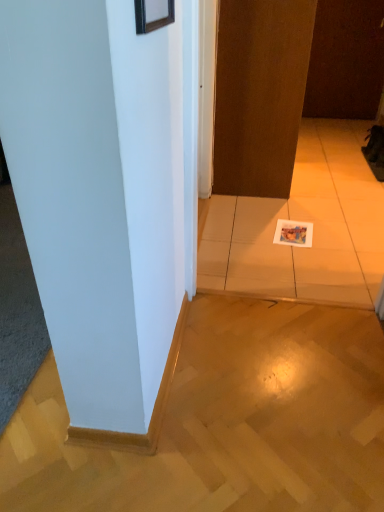
Question: Is the depth of white smooth pillar at center less than that of brown matte door at upper right, the 2th door in the bottom-to-top sequence?

Choices:
 (A) no
 (B) yes

Answer: (B)

Question: Considering the relative sizes of white smooth pillar at center and brown matte door at upper right, which is the 1th door from right to left, in the image provided, is white smooth pillar at center wider than brown matte door at upper right, which is the 1th door from right to left,?

Choices:
 (A) no
 (B) yes

Answer: (B)

Question: Can you confirm if white smooth pillar at center is bigger than brown matte door at upper right, which ranks as the second door in front-to-back order?

Choices:
 (A) no
 (B) yes

Answer: (B)

Question: Could you tell me if white smooth pillar at center is turned towards brown matte door at upper right, the 1th door viewed from the back?

Choices:
 (A) no
 (B) yes

Answer: (A)

Question: Can you confirm if white smooth pillar at center is positioned to the left of brown matte door at upper right, which is counted as the second door, starting from the left?

Choices:
 (A) no
 (B) yes

Answer: (B)

Question: In terms of height, does brown matte door at upper right, acting as the 1th door starting from the top, look taller or shorter compared to wooden picture frame at upper center?

Choices:
 (A) short
 (B) tall

Answer: (B)

Question: Considering the positions of point (317, 89) and point (153, 16), is point (317, 89) closer or farther from the camera than point (153, 16)?

Choices:
 (A) closer
 (B) farther

Answer: (B)

Question: Considering their positions, is brown matte door at upper right, acting as the 1th door starting from the top, located in front of or behind wooden picture frame at upper center?

Choices:
 (A) behind
 (B) front

Answer: (A)

Question: Is brown matte door at upper right, the 2th door in the bottom-to-top sequence, inside the boundaries of wooden picture frame at upper center, or outside?

Choices:
 (A) outside
 (B) inside

Answer: (A)

Question: Is wooden picture frame at upper center spatially inside white smooth pillar at center, or outside of it?

Choices:
 (A) inside
 (B) outside

Answer: (B)

Question: From a real-world perspective, relative to white smooth pillar at center, is wooden picture frame at upper center vertically above or below?

Choices:
 (A) below
 (B) above

Answer: (B)

Question: In terms of width, does wooden picture frame at upper center look wider or thinner when compared to white smooth pillar at center?

Choices:
 (A) wide
 (B) thin

Answer: (B)

Question: From the image's perspective, is wooden picture frame at upper center located above or below white smooth pillar at center?

Choices:
 (A) above
 (B) below

Answer: (A)

Question: Is brown matte door at center, placed as the first door when sorted from front to back, spatially inside brown matte door at upper right, which is the 1th door from right to left, or outside of it?

Choices:
 (A) inside
 (B) outside

Answer: (B)

Question: Is brown matte door at center, placed as the 2th door when sorted from back to front, bigger or smaller than brown matte door at upper right, the 1th door viewed from the back?

Choices:
 (A) big
 (B) small

Answer: (B)